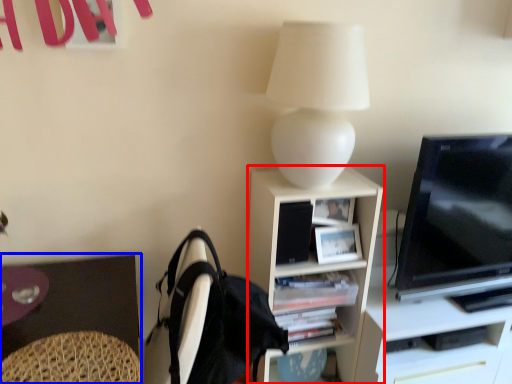
Question: Among these objects, which one is nearest to the camera, shelf (highlighted by a red box) or desk (highlighted by a blue box)?

Choices:
 (A) shelf
 (B) desk

Answer: (B)